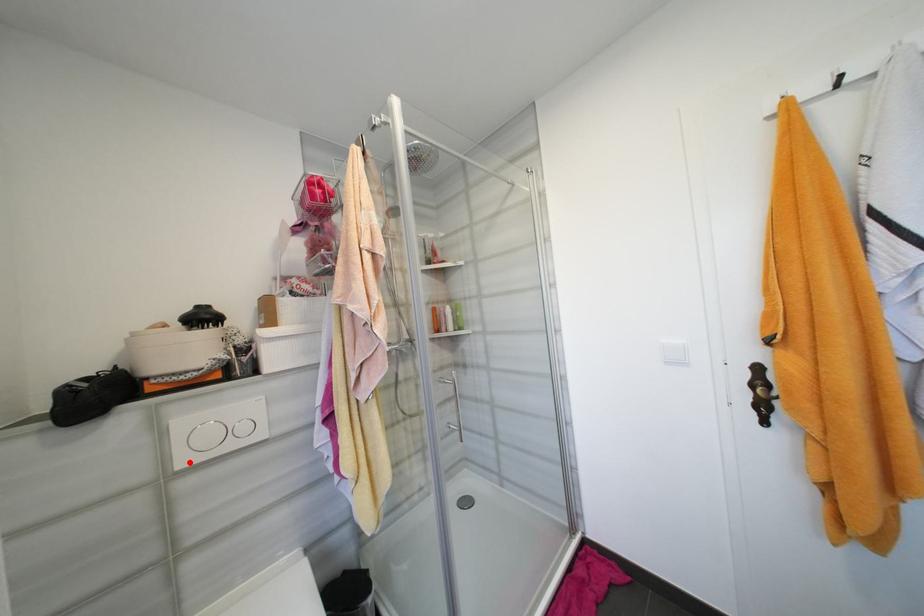
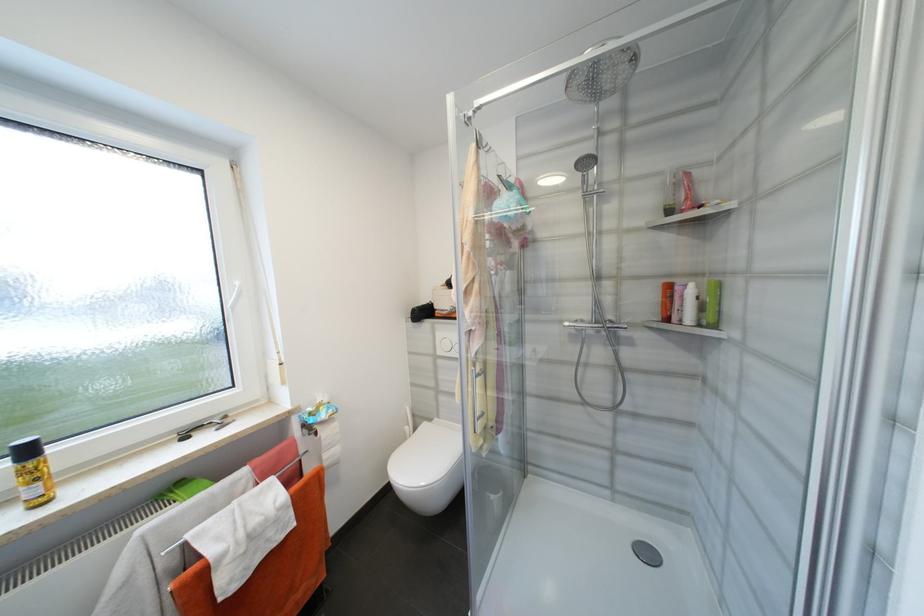
Question: I am providing you with two images of the same scene from different viewpoints. Given a red point in image1, look at the same physical point in image2. Is it:

Choices:
 (A) Closer to the viewpoint
 (B) Farther from the viewpoint

Answer: (B)